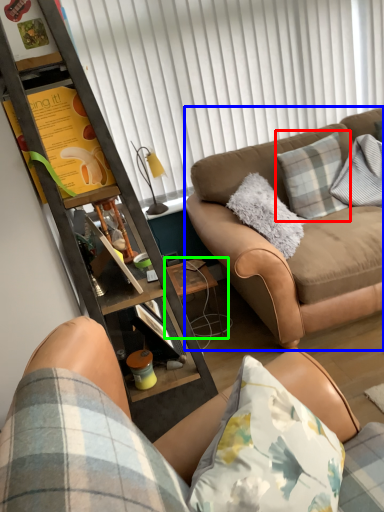
Question: Which object is positioned farthest from pillow (highlighted by a red box)? Select from studio couch (highlighted by a blue box) and side table (highlighted by a green box).

Choices:
 (A) studio couch
 (B) side table

Answer: (B)